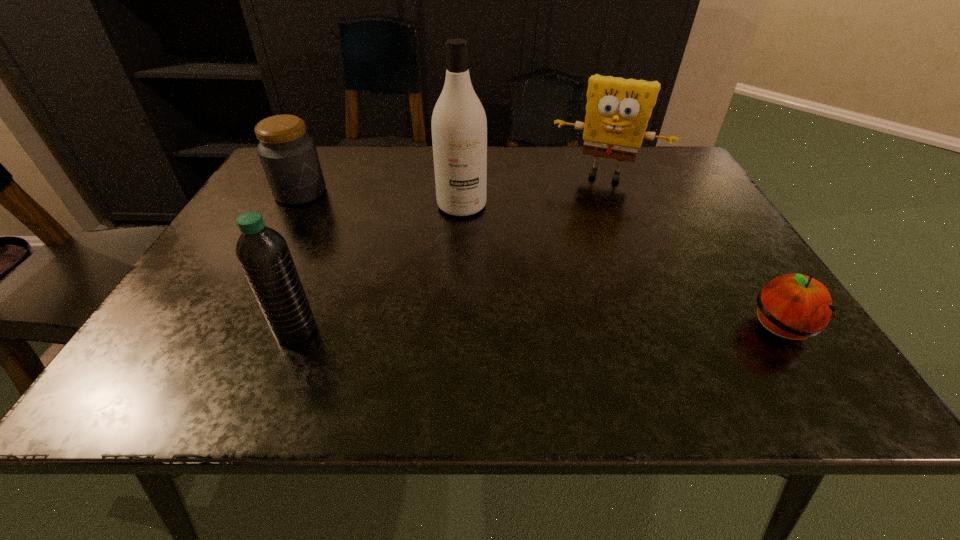
Identify the location of sponge located in the far edge section of the desktop. The width and height of the screenshot is (960, 540). (617, 112).

Locate an element on the screen. water bottle that is at the near edge is located at coordinates (263, 254).

I want to click on apple that is at the near edge, so click(x=794, y=306).

Identify the location of object present at the left edge. This screenshot has width=960, height=540. (289, 158).

This screenshot has width=960, height=540. In order to click on apple present at the right edge in this screenshot , I will do `click(794, 306)`.

Where is `sponge present at the right edge`? The height and width of the screenshot is (540, 960). sponge present at the right edge is located at coordinates (617, 112).

Locate an element on the screen. The height and width of the screenshot is (540, 960). object present at the far left corner is located at coordinates (289, 158).

Locate an element on the screen. object at the far right corner is located at coordinates (617, 112).

The height and width of the screenshot is (540, 960). What are the coordinates of `object at the near right corner` in the screenshot? It's located at (794, 306).

I want to click on vacant space at the far edge of the desktop, so click(406, 152).